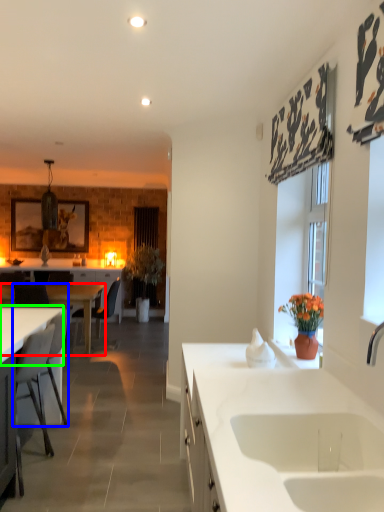
Question: Which object is the closest to the desk (highlighted by a red box)? Choose among these: armchair (highlighted by a blue box) or countertop (highlighted by a green box).

Choices:
 (A) armchair
 (B) countertop

Answer: (A)